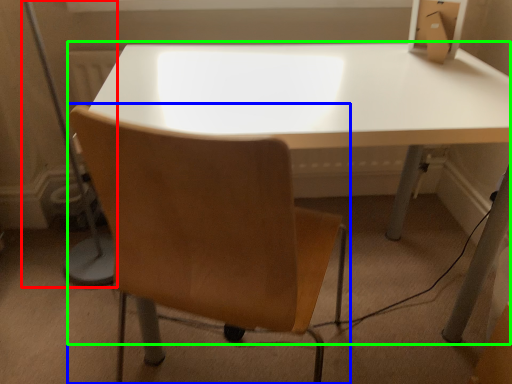
Question: Which object is the closest to the table lamp (highlighted by a red box)? Choose among these: chair (highlighted by a blue box) or table (highlighted by a green box).

Choices:
 (A) chair
 (B) table

Answer: (B)